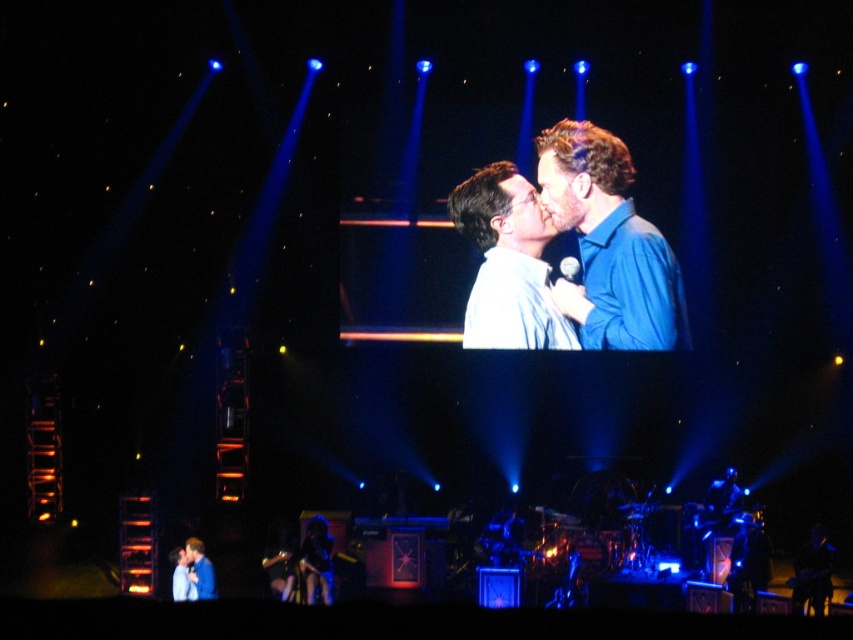
Is point (630, 294) less distant than point (325, 564)?

No, it is not.

Can you confirm if blue shirt at center is shorter than shiny black dress at lower center?

No, blue shirt at center is not shorter than shiny black dress at lower center.

Where is `blue shirt at center`? blue shirt at center is located at coordinates (608, 244).

Is blue shirt at center to the left of white glossy shirt at center from the viewer's perspective?

Incorrect, blue shirt at center is not on the left side of white glossy shirt at center.

Which is below, blue shirt at center or white glossy shirt at center?

white glossy shirt at center

Is point (621, 150) positioned behind point (532, 288)?

That is True.

Find the location of `blue shirt at center`. blue shirt at center is located at coordinates (608, 244).

Consider the image. Does blue shirt at center have a larger size compared to blue shirt at lower left?

Yes, blue shirt at center is bigger than blue shirt at lower left.

From the picture: Measure the distance between blue shirt at center and camera.

blue shirt at center and camera are 40.46 meters apart.

You are a GUI agent. You are given a task and a screenshot of the screen. Output one action in this format:
    pyautogui.click(x=<x>, y=<y>)
    Task: Click on the blue shirt at center
    This screenshot has width=853, height=640.
    Given the screenshot: What is the action you would take?
    pyautogui.click(x=608, y=244)

The height and width of the screenshot is (640, 853). Find the location of `blue shirt at center`. blue shirt at center is located at coordinates (608, 244).